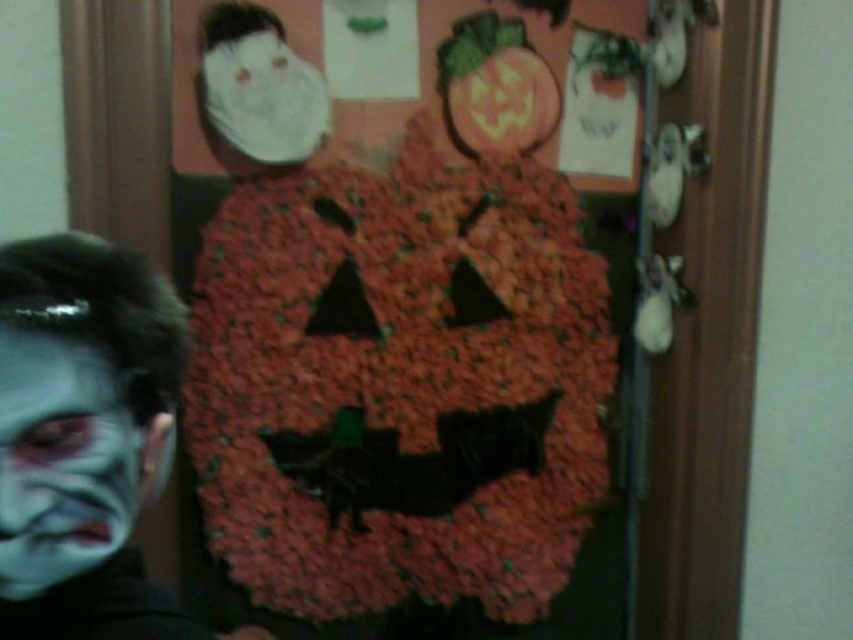
You are a makeup artist observing the Halloween scene. You notice the white matte face paint at lower left and the white matte face at lower left. Which one is located to the left of the other?

The white matte face paint at lower left is positioned on the left side of the white matte face at lower left.

You are a guest at a Halloween party and see the white matte face paint at lower left and the white matte face at lower left. Which one is closer to you?

The white matte face paint at lower left is closer to you because it is in front of the white matte face at lower left.

You are standing in front of the Halloween door and want to hang a decoration. There are two points marked on the door at coordinates point (178, 634) and point (532, 118). Which point is closer to you?

Point (178, 634) is closer to the camera than point (532, 118), so the point closer to you is point (178, 634).